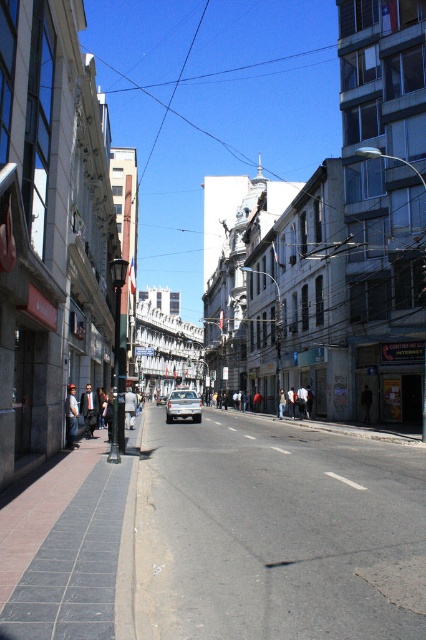
Between gray asphalt road at center and silver metallic car at center, which one appears on the right side from the viewer's perspective?

From the viewer's perspective, gray asphalt road at center appears more on the right side.

Is gray asphalt road at center shorter than silver metallic car at center?

Incorrect, gray asphalt road at center's height does not fall short of silver metallic car at center's.

Is point (241, 586) closer to camera compared to point (195, 392)?

Yes, point (241, 586) is closer to viewer.

Where is `gray asphalt road at center`? This screenshot has width=426, height=640. gray asphalt road at center is located at coordinates (276, 532).